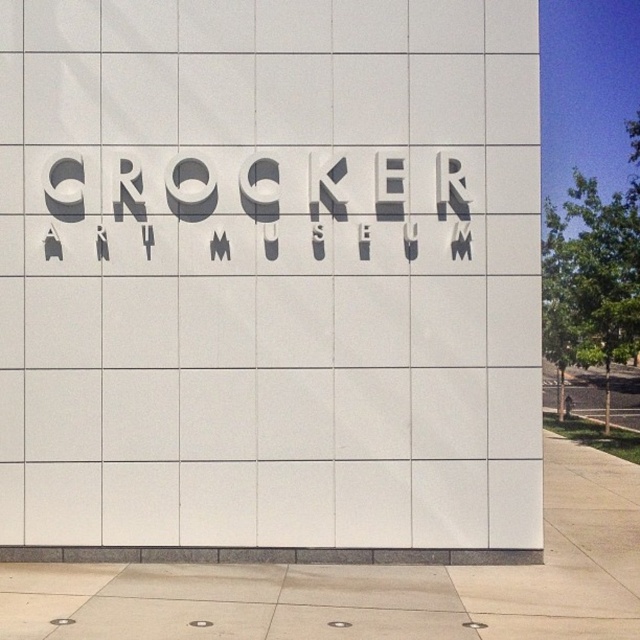
You are a delivery driver who needs to park your vehicle near the white matte sign at center and the gray concrete pavement at lower center. Which area has enough space to accommodate your vehicle?

The gray concrete pavement at lower center has a greater width than the white matte sign at center, so it can accommodate the vehicle more comfortably.

You are a visitor arriving at the Crocker Art Museum and notice the white matte sign at center and the gray concrete pavement at lower center. Which object takes up more space in the image?

The gray concrete pavement at lower center takes up more space in the image because it is larger than the white matte sign at center.

You are standing in front of the Crocker Art Museum building. You see a point at coordinate [269,275]. What object is located at that coordinate?

The point at coordinate [269,275] indicates the white matte sign at center.